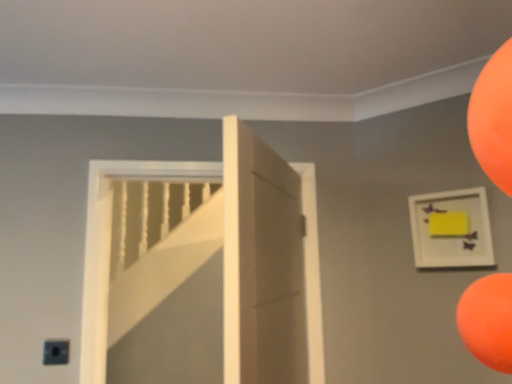
Question: From a real-world perspective, does white matte door at center stand above yellow matte picture frame at upper right?

Choices:
 (A) no
 (B) yes

Answer: (A)

Question: From the image's perspective, is white matte door at center over yellow matte picture frame at upper right?

Choices:
 (A) no
 (B) yes

Answer: (A)

Question: From a real-world perspective, is white matte door at center beneath yellow matte picture frame at upper right?

Choices:
 (A) yes
 (B) no

Answer: (A)

Question: Would you consider white matte door at center to be distant from yellow matte picture frame at upper right?

Choices:
 (A) no
 (B) yes

Answer: (A)

Question: Does white matte door at center have a greater height compared to yellow matte picture frame at upper right?

Choices:
 (A) no
 (B) yes

Answer: (B)

Question: Is white matte door at center smaller than yellow matte picture frame at upper right?

Choices:
 (A) yes
 (B) no

Answer: (B)

Question: Is there a large distance between yellow matte picture frame at upper right and white matte door at center?

Choices:
 (A) no
 (B) yes

Answer: (A)

Question: Is yellow matte picture frame at upper right at the left side of white matte door at center?

Choices:
 (A) yes
 (B) no

Answer: (B)

Question: Is yellow matte picture frame at upper right positioned with its back to white matte door at center?

Choices:
 (A) yes
 (B) no

Answer: (B)

Question: From a real-world perspective, is yellow matte picture frame at upper right physically above white matte door at center?

Choices:
 (A) yes
 (B) no

Answer: (A)

Question: Considering the relative sizes of yellow matte picture frame at upper right and white matte door at center in the image provided, is yellow matte picture frame at upper right thinner than white matte door at center?

Choices:
 (A) no
 (B) yes

Answer: (B)

Question: Would you say yellow matte picture frame at upper right is outside white matte door at center?

Choices:
 (A) no
 (B) yes

Answer: (B)

Question: Considering the positions of yellow matte picture frame at upper right and white matte door at center in the image, is yellow matte picture frame at upper right taller or shorter than white matte door at center?

Choices:
 (A) short
 (B) tall

Answer: (A)